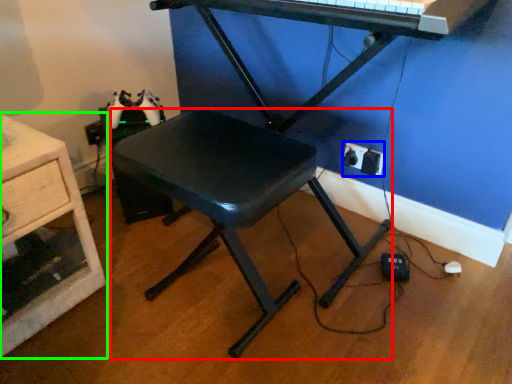
Question: Which is nearer to the stool (highlighted by a red box)? electric outlet (highlighted by a blue box) or furniture (highlighted by a green box).

Choices:
 (A) electric outlet
 (B) furniture

Answer: (B)